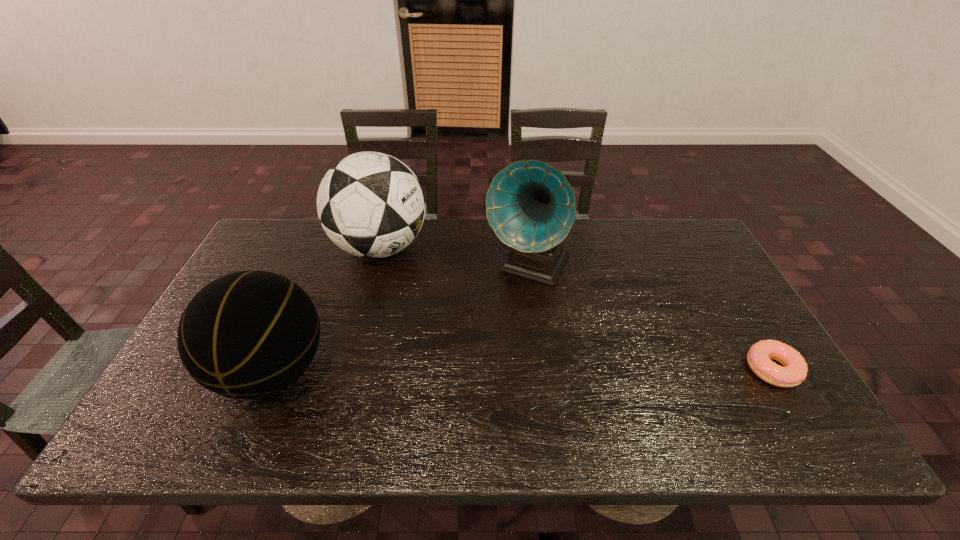
Identify the location of object at the near left corner. The height and width of the screenshot is (540, 960). (250, 334).

What are the coordinates of `object situated at the near right corner` in the screenshot? It's located at (794, 371).

In the image, there is a desktop. Where is `vacant space at the far edge`? vacant space at the far edge is located at coordinates (474, 242).

Find the location of a particular element. The image size is (960, 540). free space at the near edge is located at coordinates [x=499, y=376].

In the image, there is a desktop. At what (x,y) coordinates should I click in order to perform the action: click on blank space at the right edge. Please return your answer as a coordinate pair (x, y). Looking at the image, I should click on (730, 302).

Where is `free space at the far left corner`? The width and height of the screenshot is (960, 540). free space at the far left corner is located at coordinates (268, 261).

Where is `vacant space at the far right corner of the desktop`? The width and height of the screenshot is (960, 540). vacant space at the far right corner of the desktop is located at coordinates (694, 244).

Locate an element on the screen. This screenshot has width=960, height=540. free space between the soccer ball and the basketball is located at coordinates (326, 309).

The height and width of the screenshot is (540, 960). What are the coordinates of `free space between the soccer ball and the basketball` in the screenshot? It's located at (326, 309).

Image resolution: width=960 pixels, height=540 pixels. In order to click on free space between the basketball and the rightmost object in this screenshot , I will do `click(522, 370)`.